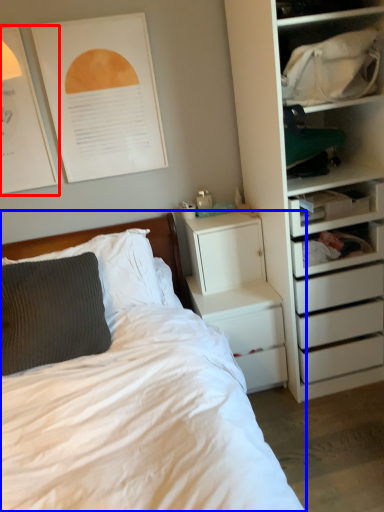
Question: Which point is further to the camera, poster page (highlighted by a red box) or bed (highlighted by a blue box)?

Choices:
 (A) poster page
 (B) bed

Answer: (A)